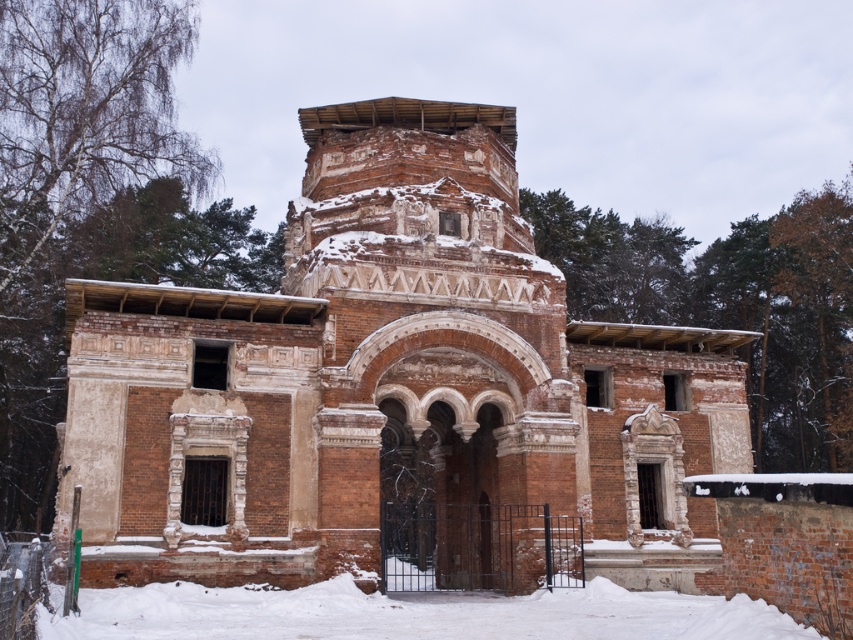
Question: Among these points, which one is farthest from the camera?

Choices:
 (A) (467, 476)
 (B) (659, 624)

Answer: (A)

Question: Observing the image, what is the correct spatial positioning of reddish-brown brick church at center in reference to white powdery snow at lower center?

Choices:
 (A) below
 (B) above

Answer: (B)

Question: Is reddish-brown brick church at center to the right of white powdery snow at lower center from the viewer's perspective?

Choices:
 (A) no
 (B) yes

Answer: (A)

Question: Can you confirm if reddish-brown brick church at center is bigger than white powdery snow at lower center?

Choices:
 (A) no
 (B) yes

Answer: (B)